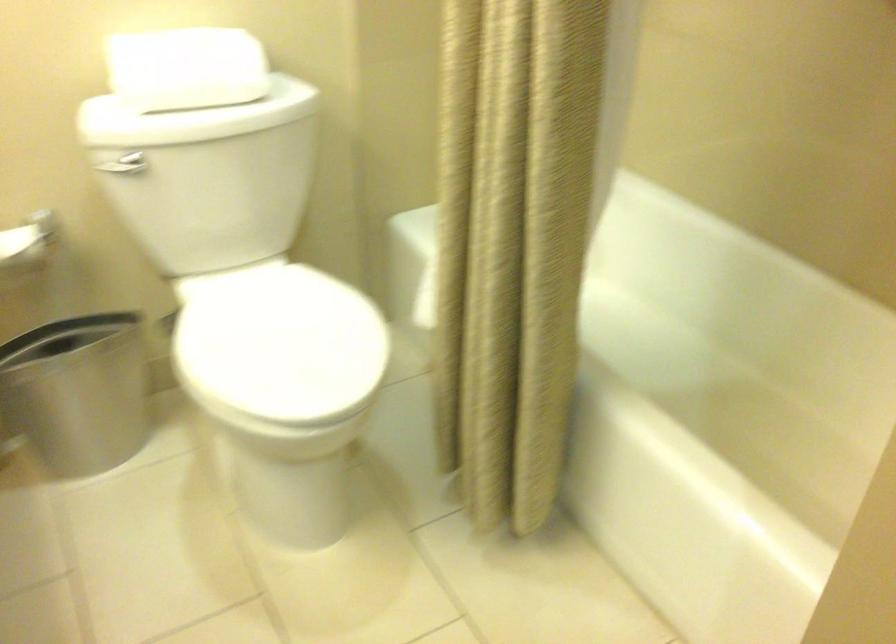
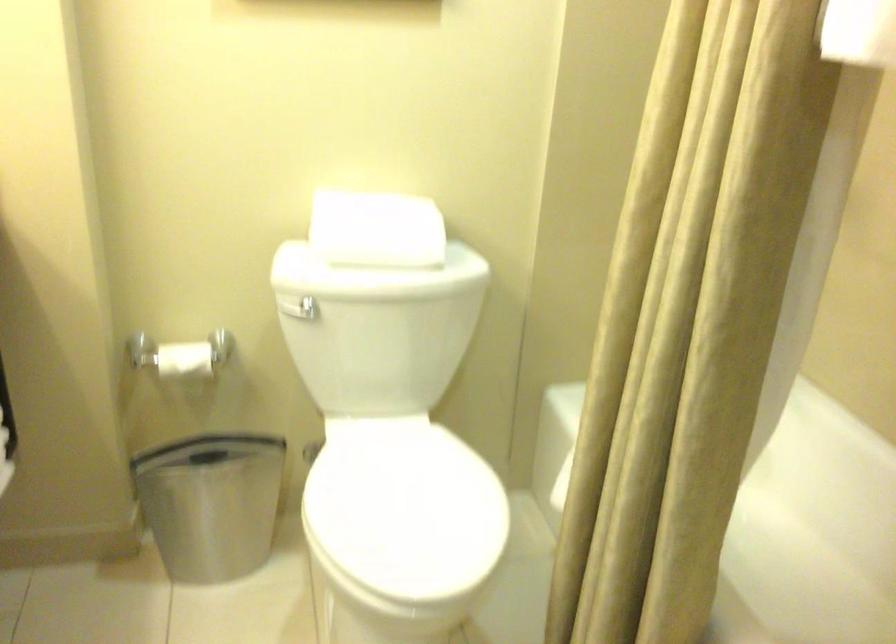
Question: Based on the continuous images, in which direction is the camera rotating? Reply with the corresponding letter.

Choices:
 (A) Left
 (B) Right
 (C) Up
 (D) Down

Answer: (A)